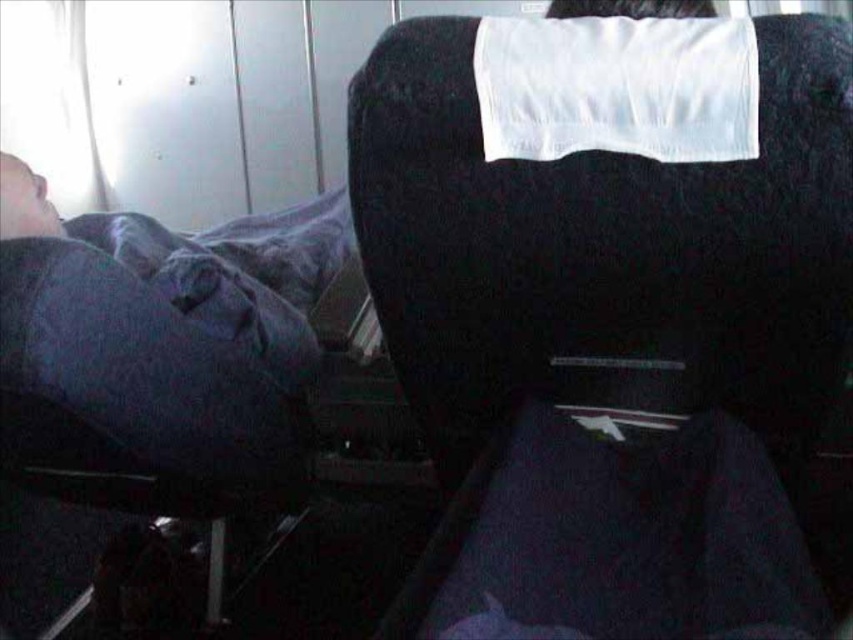
Question: Is black fabric chair at upper right below dark blue fabric at left?

Choices:
 (A) yes
 (B) no

Answer: (A)

Question: Does black fabric chair at upper right appear on the right side of dark blue fabric at left?

Choices:
 (A) no
 (B) yes

Answer: (B)

Question: Among these objects, which one is nearest to the camera?

Choices:
 (A) dark blue fabric at left
 (B) black fabric chair at upper right

Answer: (B)

Question: Can you confirm if black fabric chair at upper right is wider than dark blue fabric at left?

Choices:
 (A) yes
 (B) no

Answer: (A)

Question: Which object appears farthest from the camera in this image?

Choices:
 (A) black fabric chair at upper right
 (B) dark blue fabric at left

Answer: (B)